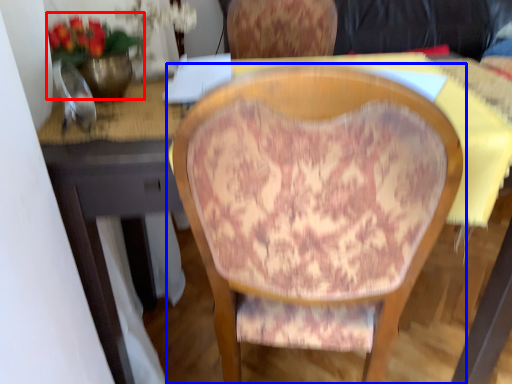
Question: Which object is further to the camera taking this photo, floral arrangement (highlighted by a red box) or chair (highlighted by a blue box)?

Choices:
 (A) floral arrangement
 (B) chair

Answer: (A)